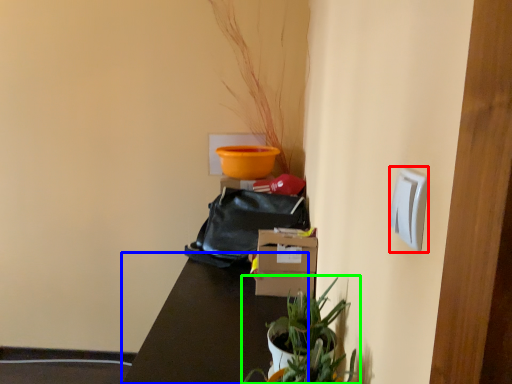
Question: Based on their relative distances, which object is nearer to light switch (highlighted by a red box)? Choose from table (highlighted by a blue box) and houseplant (highlighted by a green box).

Choices:
 (A) table
 (B) houseplant

Answer: (B)